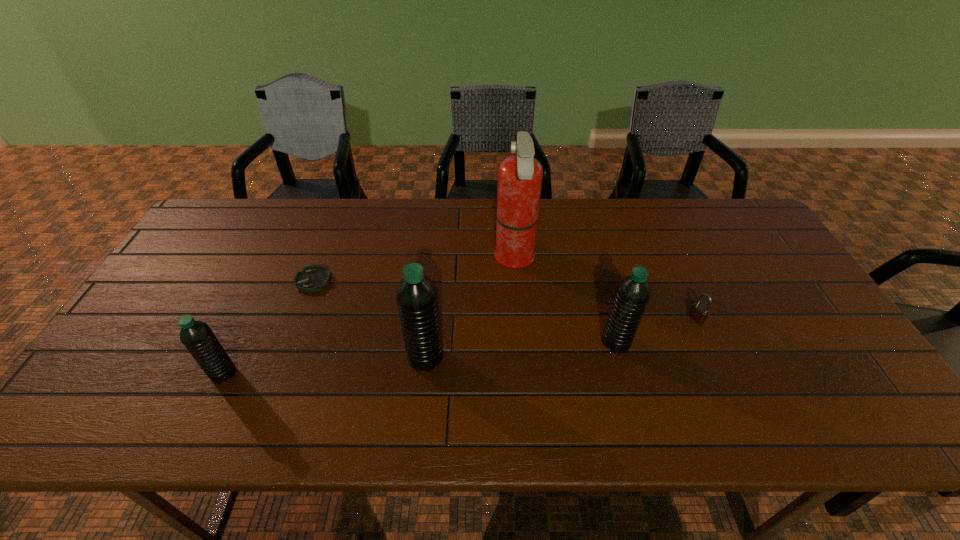
At what (x,y) coordinates should I click in order to perform the action: click on vacant spot to place a water bottle on the right. Please return your answer as a coordinate pair (x, y). The width and height of the screenshot is (960, 540). Looking at the image, I should click on (796, 328).